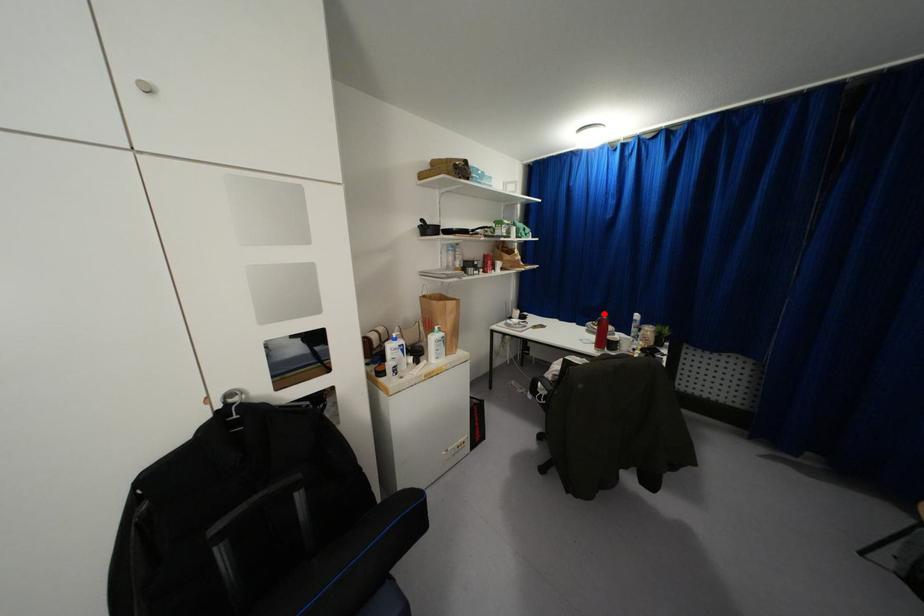
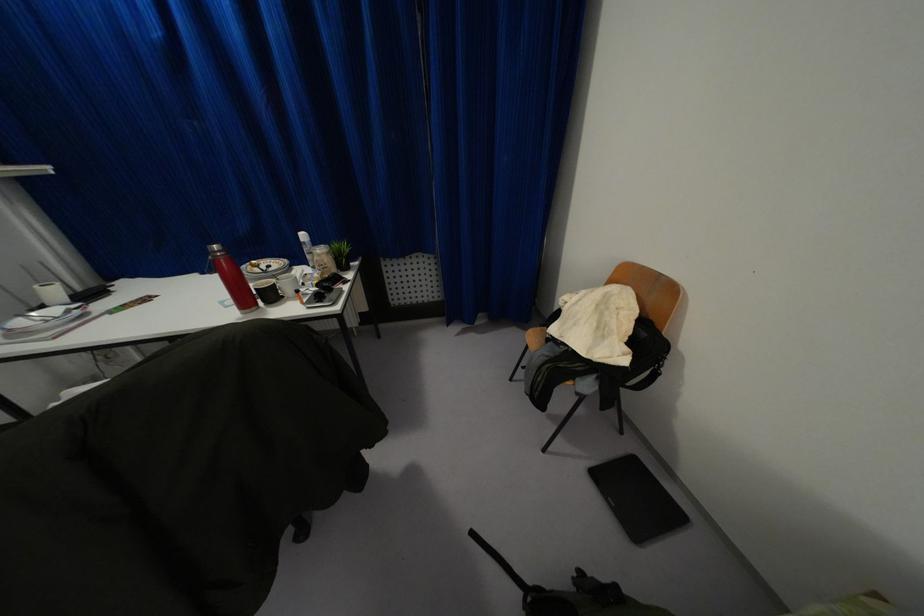
Question: A red point is marked in image1. In image2, is the corresponding 3D point closer to the camera or farther? Reply with the corresponding letter.

Choices:
 (A) The corresponding 3D point is closer.
 (B) The corresponding 3D point is farther.

Answer: (B)